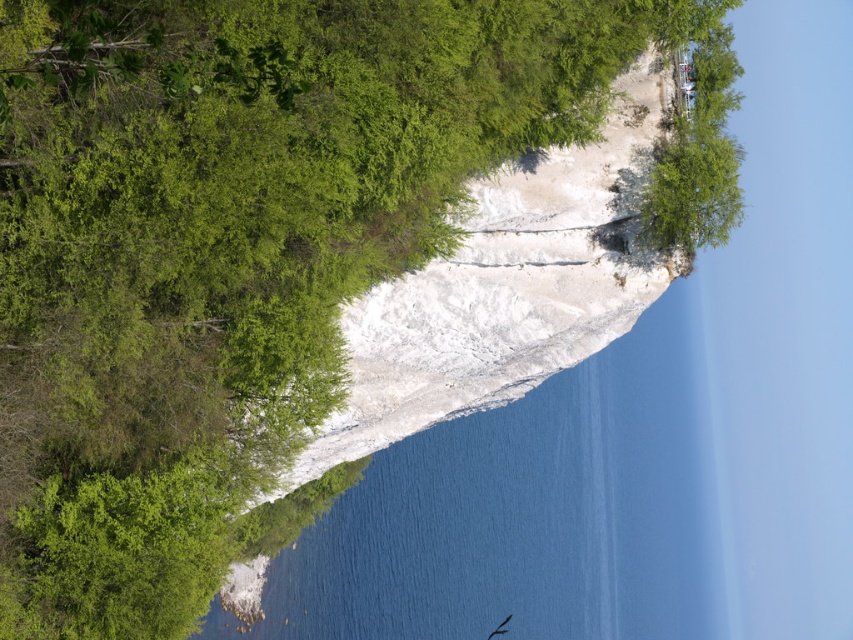
You are standing at the base of the cliff and looking up. Which object is closer to you, the clear blue water at center or the green leafy tree at upper right?

The clear blue water at center is closer to you because it is further to the viewer than the green leafy tree at upper right.

You are standing at the base of the cliff and want to reach the top. You see two points marked on the cliff face. Which point, point (479, 636) or point (666, 221), is closer to you and thus easier to reach?

Point (479, 636) is closer to you than point (666, 221), so it is easier to reach.

You are a hiker standing at the base of the cliff and want to reach the top. You notice two points marked on the cliff face. Which point is closer to you, point (651, 416) or point (509, 620)?

Point (651, 416) is closer to you because it is further to the viewer than point (509, 620).